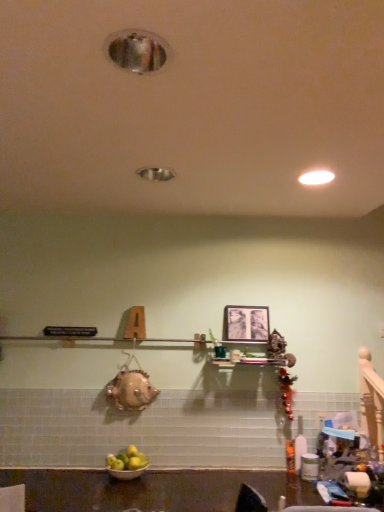
Question: Considering the relative sizes of white glossy bowl at lower center and white glossy light fixture at upper right in the image provided, is white glossy bowl at lower center taller than white glossy light fixture at upper right?

Choices:
 (A) no
 (B) yes

Answer: (B)

Question: Could you tell me if white glossy bowl at lower center is facing white glossy light fixture at upper right?

Choices:
 (A) no
 (B) yes

Answer: (A)

Question: Is white glossy bowl at lower center positioned behind white glossy light fixture at upper right?

Choices:
 (A) no
 (B) yes

Answer: (B)

Question: From a real-world perspective, is white glossy bowl at lower center under white glossy light fixture at upper right?

Choices:
 (A) no
 (B) yes

Answer: (B)

Question: From the image's perspective, is white glossy bowl at lower center located beneath white glossy light fixture at upper right?

Choices:
 (A) yes
 (B) no

Answer: (A)

Question: In terms of size, does white glossy bowl at lower center appear bigger or smaller than white glossy light fixture at upper right?

Choices:
 (A) small
 (B) big

Answer: (B)

Question: From their relative heights in the image, would you say white glossy bowl at lower center is taller or shorter than white glossy light fixture at upper right?

Choices:
 (A) tall
 (B) short

Answer: (A)

Question: From the image's perspective, relative to white glossy light fixture at upper right, is white glossy bowl at lower center above or below?

Choices:
 (A) below
 (B) above

Answer: (A)

Question: From a real-world perspective, is white glossy bowl at lower center positioned above or below white glossy light fixture at upper right?

Choices:
 (A) below
 (B) above

Answer: (A)

Question: Considering the positions of white glossy bowl at lower center and matte black picture frame at center in the image, is white glossy bowl at lower center bigger or smaller than matte black picture frame at center?

Choices:
 (A) small
 (B) big

Answer: (B)

Question: Relative to matte black picture frame at center, is white glossy bowl at lower center in front or behind?

Choices:
 (A) behind
 (B) front

Answer: (B)

Question: From the image's perspective, is white glossy bowl at lower center positioned above or below matte black picture frame at center?

Choices:
 (A) below
 (B) above

Answer: (A)

Question: Is point (122, 475) closer or farther from the camera than point (233, 325)?

Choices:
 (A) farther
 (B) closer

Answer: (B)

Question: Considering the positions of point (230, 333) and point (319, 179), is point (230, 333) closer or farther from the camera than point (319, 179)?

Choices:
 (A) closer
 (B) farther

Answer: (B)

Question: From the image's perspective, relative to white glossy light fixture at upper right, is matte black picture frame at center above or below?

Choices:
 (A) above
 (B) below

Answer: (B)